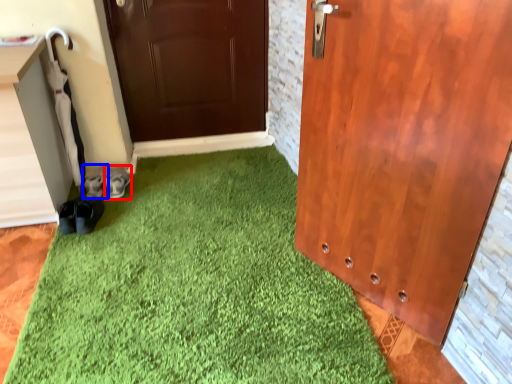
Question: Which object appears closest to the camera in this image, footwear (highlighted by a red box) or footwear (highlighted by a blue box)?

Choices:
 (A) footwear
 (B) footwear

Answer: (A)